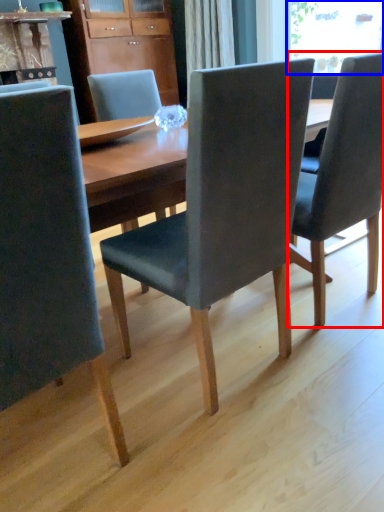
Question: Which point is further to the camera, chair (highlighted by a red box) or window screen (highlighted by a blue box)?

Choices:
 (A) chair
 (B) window screen

Answer: (B)